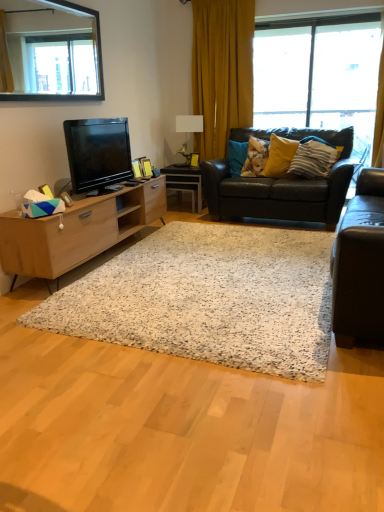
Question: Is black glass mirror at upper left taller than fluffy fabric pillow at center, which is counted as the first pillow, starting from the left?

Choices:
 (A) yes
 (B) no

Answer: (A)

Question: Is black glass mirror at upper left at the left side of fluffy fabric pillow at center, placed as the third pillow when sorted from right to left?

Choices:
 (A) yes
 (B) no

Answer: (A)

Question: Is black glass mirror at upper left with fluffy fabric pillow at center, placed as the third pillow when sorted from right to left?

Choices:
 (A) yes
 (B) no

Answer: (B)

Question: Considering the relative sizes of black glass mirror at upper left and fluffy fabric pillow at center, which is counted as the first pillow, starting from the left, in the image provided, is black glass mirror at upper left thinner than fluffy fabric pillow at center, which is counted as the first pillow, starting from the left,?

Choices:
 (A) no
 (B) yes

Answer: (B)

Question: Considering the relative positions of black glass mirror at upper left and fluffy fabric pillow at center, placed as the third pillow when sorted from right to left, in the image provided, is black glass mirror at upper left to the right of fluffy fabric pillow at center, placed as the third pillow when sorted from right to left, from the viewer's perspective?

Choices:
 (A) no
 (B) yes

Answer: (A)

Question: Is black glass mirror at upper left far from fluffy fabric pillow at center, which is counted as the first pillow, starting from the left?

Choices:
 (A) no
 (B) yes

Answer: (B)

Question: Is yellow fabric curtain at upper center facing away from leather couch at right, the second studio couch positioned from the back?

Choices:
 (A) no
 (B) yes

Answer: (A)

Question: Would you say leather couch at right, acting as the first studio couch starting from the front, is part of yellow fabric curtain at upper center's contents?

Choices:
 (A) yes
 (B) no

Answer: (B)

Question: Does yellow fabric curtain at upper center have a greater height compared to leather couch at right, the second studio couch positioned from the back?

Choices:
 (A) yes
 (B) no

Answer: (A)

Question: Is the position of yellow fabric curtain at upper center more distant than that of leather couch at right, acting as the first studio couch starting from the front?

Choices:
 (A) no
 (B) yes

Answer: (B)

Question: From a real-world perspective, is yellow fabric curtain at upper center physically below leather couch at right, acting as the first studio couch starting from the front?

Choices:
 (A) yes
 (B) no

Answer: (B)

Question: From the image's perspective, is yellow fabric curtain at upper center under leather couch at right, the second studio couch positioned from the back?

Choices:
 (A) no
 (B) yes

Answer: (A)

Question: Does black glass mirror at upper left have a larger size compared to yellow matte pillow at upper right, which is the second pillow in right-to-left order?

Choices:
 (A) no
 (B) yes

Answer: (B)